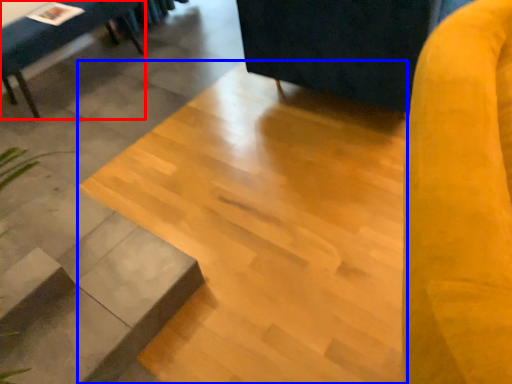
Question: Among these objects, which one is farthest to the camera, furniture (highlighted by a red box) or concrete (highlighted by a blue box)?

Choices:
 (A) furniture
 (B) concrete

Answer: (A)